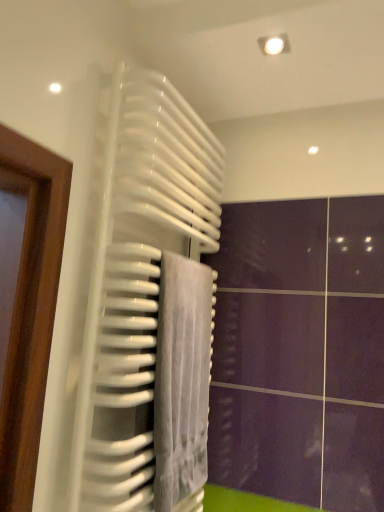
Question: Does gray velvety towel at center lie behind white glossy radiator at center?

Choices:
 (A) no
 (B) yes

Answer: (B)

Question: Is gray velvety towel at center shorter than white glossy radiator at center?

Choices:
 (A) yes
 (B) no

Answer: (A)

Question: Is gray velvety towel at center positioned with its back to white glossy radiator at center?

Choices:
 (A) no
 (B) yes

Answer: (B)

Question: Is gray velvety towel at center smaller than white glossy radiator at center?

Choices:
 (A) yes
 (B) no

Answer: (A)

Question: From the image's perspective, is gray velvety towel at center on white glossy radiator at center?

Choices:
 (A) no
 (B) yes

Answer: (A)

Question: Considering the relative sizes of gray velvety towel at center and white glossy radiator at center in the image provided, is gray velvety towel at center taller than white glossy radiator at center?

Choices:
 (A) yes
 (B) no

Answer: (B)

Question: Is white glossy radiator at center facing towards gray velvety towel at center?

Choices:
 (A) yes
 (B) no

Answer: (A)

Question: Can you confirm if white glossy radiator at center is taller than gray velvety towel at center?

Choices:
 (A) no
 (B) yes

Answer: (B)

Question: From the image's perspective, does white glossy radiator at center appear lower than gray velvety towel at center?

Choices:
 (A) yes
 (B) no

Answer: (B)

Question: From a real-world perspective, does white glossy radiator at center sit lower than gray velvety towel at center?

Choices:
 (A) yes
 (B) no

Answer: (B)

Question: From a real-world perspective, is white glossy radiator at center over gray velvety towel at center?

Choices:
 (A) yes
 (B) no

Answer: (A)

Question: Can you confirm if white glossy radiator at center is smaller than gray velvety towel at center?

Choices:
 (A) yes
 (B) no

Answer: (B)

Question: From a real-world perspective, is gray velvety towel at center above or below white glossy radiator at center?

Choices:
 (A) above
 (B) below

Answer: (B)